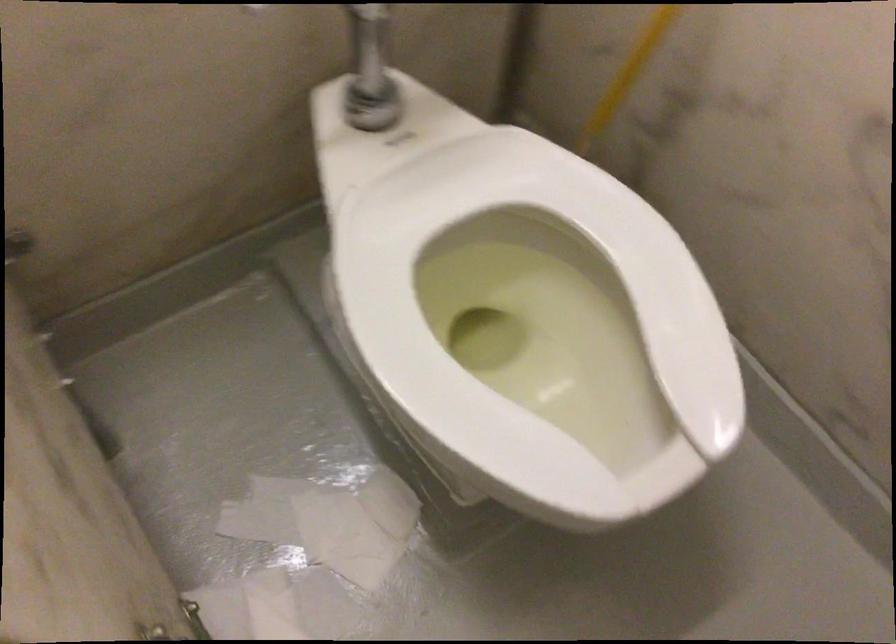
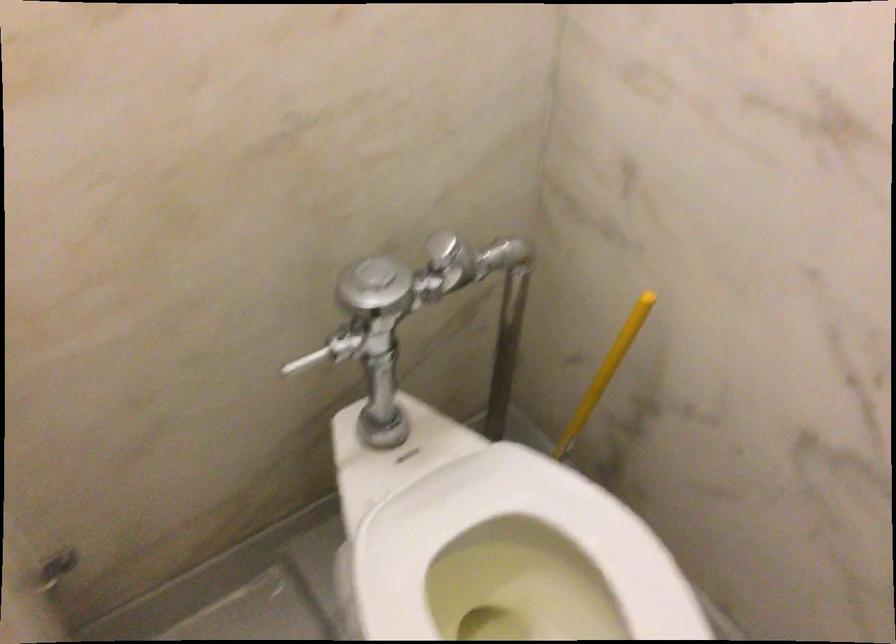
Question: The images are taken continuously from a first-person perspective. In which direction is your viewpoint rotating?

Choices:
 (A) Left
 (B) Right
 (C) Up
 (D) Down

Answer: (C)